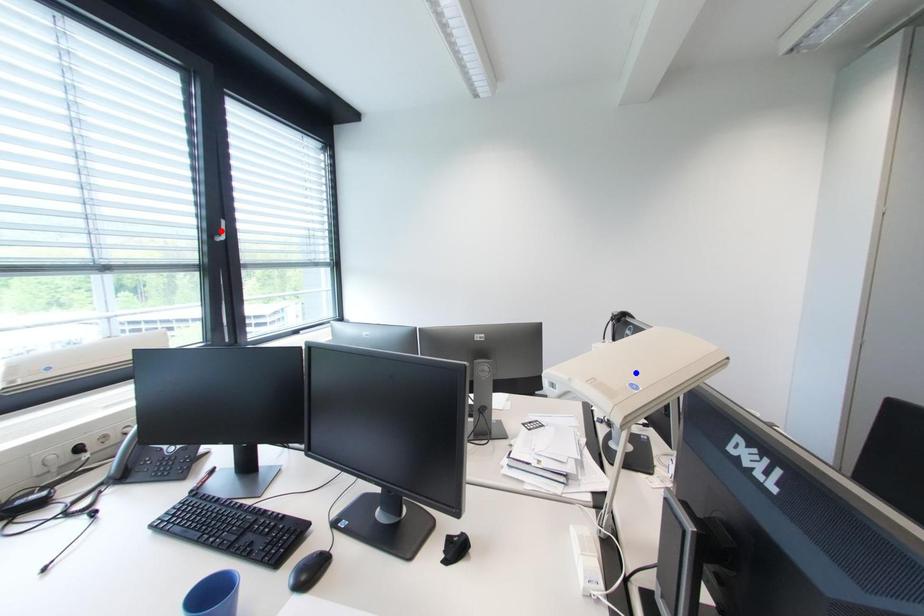
Question: In the image, two points are highlighted. Which point is nearer to the camera? Reply with the corresponding letter.

Choices:
 (A) blue point
 (B) red point

Answer: (A)